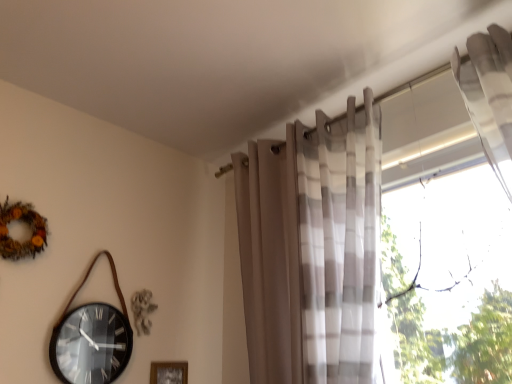
Question: Can you confirm if wooden frame at lower center is positioned to the right of translucent sheer curtain at upper right?

Choices:
 (A) no
 (B) yes

Answer: (A)

Question: Is translucent sheer curtain at upper right surrounded by wooden frame at lower center?

Choices:
 (A) yes
 (B) no

Answer: (B)

Question: Can you confirm if wooden frame at lower center is thinner than translucent sheer curtain at upper right?

Choices:
 (A) no
 (B) yes

Answer: (B)

Question: Are wooden frame at lower center and translucent sheer curtain at upper right located far from each other?

Choices:
 (A) yes
 (B) no

Answer: (B)

Question: Does wooden frame at lower center appear on the left side of translucent sheer curtain at upper right?

Choices:
 (A) yes
 (B) no

Answer: (A)

Question: Is wooden frame at lower center turned away from translucent sheer curtain at upper right?

Choices:
 (A) yes
 (B) no

Answer: (B)

Question: Does translucent sheer curtain at upper right have a larger size compared to wooden frame at lower center?

Choices:
 (A) yes
 (B) no

Answer: (A)

Question: From a real-world perspective, is translucent sheer curtain at upper right over wooden frame at lower center?

Choices:
 (A) yes
 (B) no

Answer: (A)

Question: Is translucent sheer curtain at upper right placed right next to wooden frame at lower center?

Choices:
 (A) yes
 (B) no

Answer: (B)

Question: From the image's perspective, is translucent sheer curtain at upper right over wooden frame at lower center?

Choices:
 (A) yes
 (B) no

Answer: (A)

Question: Is translucent sheer curtain at upper right at the right side of wooden frame at lower center?

Choices:
 (A) yes
 (B) no

Answer: (A)

Question: Is translucent sheer curtain at upper right further to camera compared to wooden frame at lower center?

Choices:
 (A) no
 (B) yes

Answer: (A)

Question: Can we say wooden frame at lower center lies outside transparent glass window at right?

Choices:
 (A) no
 (B) yes

Answer: (B)